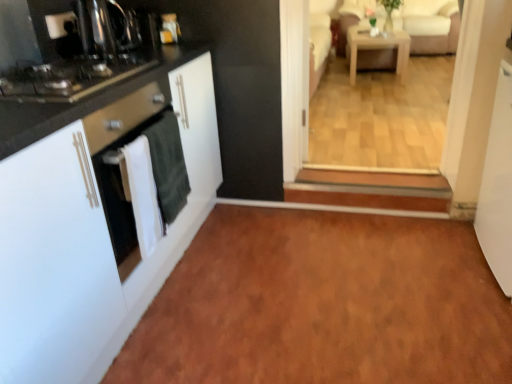
The height and width of the screenshot is (384, 512). What do you see at coordinates (67, 49) in the screenshot?
I see `black glass stove at left` at bounding box center [67, 49].

Where is `beige fabric couch at upper right`? The image size is (512, 384). beige fabric couch at upper right is located at coordinates (430, 25).

Describe the element at coordinates (430, 25) in the screenshot. The width and height of the screenshot is (512, 384). I see `beige fabric couch at upper right` at that location.

The height and width of the screenshot is (384, 512). Describe the element at coordinates (377, 48) in the screenshot. I see `light wood/wooden table at center` at that location.

Image resolution: width=512 pixels, height=384 pixels. What are the coordinates of `black glass stove at left` in the screenshot? It's located at (67, 49).

Between brown laminate floor at lower center and light wood/wooden table at center, which one has smaller width?

light wood/wooden table at center is thinner.

Based on the photo, considering the relative positions of brown laminate floor at lower center and light wood/wooden table at center in the image provided, is brown laminate floor at lower center to the left of light wood/wooden table at center from the viewer's perspective?

Yes.

Does brown laminate floor at lower center have a greater height compared to light wood/wooden table at center?

Incorrect, the height of brown laminate floor at lower center is not larger of that of light wood/wooden table at center.

From the image's perspective, does brown laminate floor at lower center appear lower than light wood/wooden table at center?

Yes.

The height and width of the screenshot is (384, 512). In order to click on couch behind the white glossy refrigerator at right in this screenshot , I will do `click(430, 25)`.

Does white glossy refrigerator at right turn towards beige fabric couch at upper right?

No, white glossy refrigerator at right is not aimed at beige fabric couch at upper right.

From the image's perspective, between white glossy refrigerator at right and beige fabric couch at upper right, who is located below?

white glossy refrigerator at right.

From a real-world perspective, between white glossy refrigerator at right and beige fabric couch at upper right, who is vertically lower?

white glossy refrigerator at right is physically lower.

Image resolution: width=512 pixels, height=384 pixels. In order to click on home appliance that is behind the brown laminate floor at lower center in this screenshot , I will do `click(67, 49)`.

Does black glass stove at left have a lesser width compared to brown laminate floor at lower center?

Correct, the width of black glass stove at left is less than that of brown laminate floor at lower center.

Is black glass stove at left bigger than brown laminate floor at lower center?

Incorrect, black glass stove at left is not larger than brown laminate floor at lower center.

Considering the relative sizes of light wood/wooden table at center and black glass stove at left in the image provided, is light wood/wooden table at center smaller than black glass stove at left?

Actually, light wood/wooden table at center might be larger than black glass stove at left.

Who is taller, light wood/wooden table at center or black glass stove at left?

With more height is light wood/wooden table at center.

Considering their positions, is light wood/wooden table at center located in front of or behind black glass stove at left?

Visually, light wood/wooden table at center is located behind black glass stove at left.

Locate an element on the screen. home appliance below the light wood/wooden table at center (from the image's perspective) is located at coordinates (67, 49).

Is point (451, 6) closer to viewer compared to point (95, 307)?

No.

From the image's perspective, between beige fabric couch at upper right and white matte cabinet at left, which one is located above?

beige fabric couch at upper right, from the image's perspective.

Can you confirm if beige fabric couch at upper right is shorter than white matte cabinet at left?

Yes, beige fabric couch at upper right is shorter than white matte cabinet at left.

Is beige fabric couch at upper right spatially inside white matte cabinet at left, or outside of it?

beige fabric couch at upper right exists outside the volume of white matte cabinet at left.

Is beige fabric couch at upper right placed right next to brown laminate floor at lower center?

beige fabric couch at upper right and brown laminate floor at lower center are clearly separated.

Could brown laminate floor at lower center be considered to be inside beige fabric couch at upper right?

No, brown laminate floor at lower center is located outside of beige fabric couch at upper right.

Considering the sizes of objects beige fabric couch at upper right and brown laminate floor at lower center in the image provided, who is wider, beige fabric couch at upper right or brown laminate floor at lower center?

brown laminate floor at lower center.

In the scene shown: From a real-world perspective, is beige fabric couch at upper right above or below brown laminate floor at lower center?

From a real-world perspective, beige fabric couch at upper right is physically above brown laminate floor at lower center.

Is point (499, 234) less distant than point (132, 17)?

Yes.

Can you confirm if white glossy refrigerator at right is smaller than black glass stove at left?

Incorrect, white glossy refrigerator at right is not smaller in size than black glass stove at left.

Would you say white glossy refrigerator at right is a long distance from black glass stove at left?

Yes.

From a real-world perspective, does white glossy refrigerator at right stand above black glass stove at left?

Incorrect, from a real-world perspective, white glossy refrigerator at right is lower than black glass stove at left.

Identify the location of table that is above the brown laminate floor at lower center (from a real-world perspective). coord(377,48).

Locate an element on the screen. This screenshot has width=512, height=384. screen door lying on the left of beige fabric couch at upper right is located at coordinates (498, 186).

From the image, which object appears to be nearer to brown laminate floor at lower center, white glossy refrigerator at right or white matte cabinet at left?

white glossy refrigerator at right is closer to brown laminate floor at lower center.

Estimate the real-world distances between objects in this image. Which object is further from beige fabric couch at upper right, light wood/wooden table at center or black glass stove at left?

Based on the image, black glass stove at left appears to be further to beige fabric couch at upper right.

From the image, which object appears to be nearer to black glass stove at left, brown laminate floor at lower center or light wood/wooden table at center?

brown laminate floor at lower center lies closer to black glass stove at left than the other object.

Looking at the image, which one is located further to black glass stove at left, white glossy refrigerator at right or light wood/wooden table at center?

Among the two, light wood/wooden table at center is located further to black glass stove at left.

Considering their positions, is white matte cabinet at left positioned further to brown laminate floor at lower center than beige fabric couch at upper right?

Based on the image, beige fabric couch at upper right appears to be further to brown laminate floor at lower center.

Looking at the image, which one is located closer to light wood/wooden table at center, brown laminate floor at lower center or black glass stove at left?

brown laminate floor at lower center is closer to light wood/wooden table at center.

Which object lies nearer to the anchor point white glossy refrigerator at right, light wood/wooden table at center or brown laminate floor at lower center?

Based on the image, brown laminate floor at lower center appears to be nearer to white glossy refrigerator at right.

When comparing their distances from light wood/wooden table at center, does beige fabric couch at upper right or white glossy refrigerator at right seem closer?

Among the two, beige fabric couch at upper right is located nearer to light wood/wooden table at center.

Locate an element on the screen. The width and height of the screenshot is (512, 384). table positioned between white glossy refrigerator at right and beige fabric couch at upper right from near to far is located at coordinates (377, 48).

Locate an element on the screen. home appliance between brown laminate floor at lower center and beige fabric couch at upper right in the front-back direction is located at coordinates (67, 49).

The width and height of the screenshot is (512, 384). Find the location of `table between brown laminate floor at lower center and beige fabric couch at upper right along the z-axis`. table between brown laminate floor at lower center and beige fabric couch at upper right along the z-axis is located at coordinates (377, 48).

Locate an element on the screen. screen door between brown laminate floor at lower center and light wood/wooden table at center in the front-back direction is located at coordinates (498, 186).